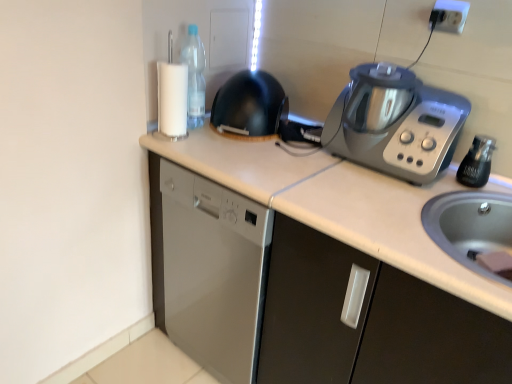
Where is `blank space above white matte countertop at center (from a real-world perspective)`? blank space above white matte countertop at center (from a real-world perspective) is located at coordinates (327, 172).